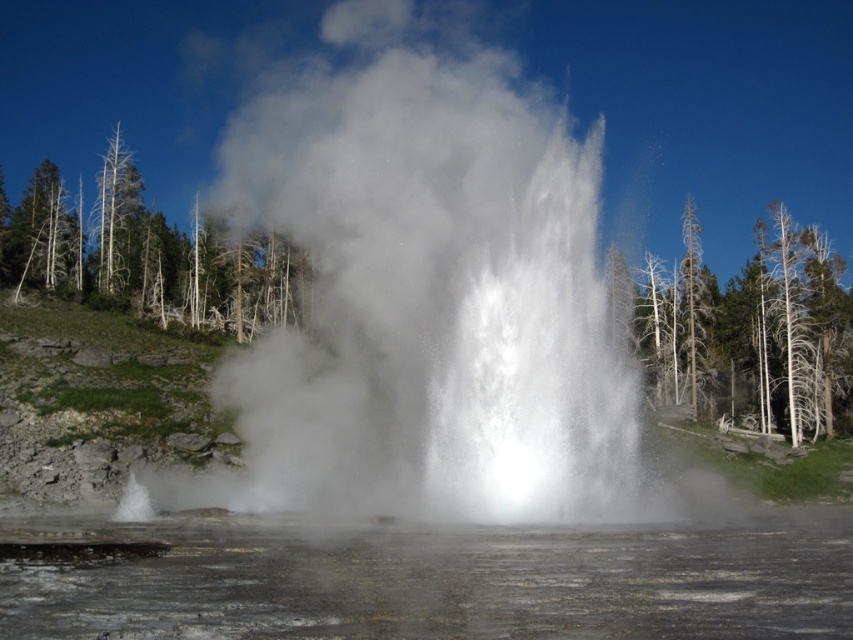
Where is `translucent steam at center`? translucent steam at center is located at coordinates (439, 580).

Which of these two, translucent steam at center or dead wood tree at left, stands taller?

dead wood tree at left is taller.

Identify the location of translucent steam at center. Image resolution: width=853 pixels, height=640 pixels. (439, 580).

Which is behind, point (830, 410) or point (22, 236)?

Positioned behind is point (22, 236).

Does dead wood trees at right have a greater height compared to green leafy trees at left?

In fact, dead wood trees at right may be shorter than green leafy trees at left.

Find the location of a particular element. dead wood trees at right is located at coordinates (751, 330).

Between translucent steam at center and green leafy trees at left, which one has less height?

translucent steam at center

How much distance is there between translucent steam at center and green leafy trees at left?

The distance of translucent steam at center from green leafy trees at left is 48.61 meters.

Who is more forward, (338, 566) or (135, 282)?

Point (338, 566) is more forward.

This screenshot has width=853, height=640. I want to click on translucent steam at center, so [439, 580].